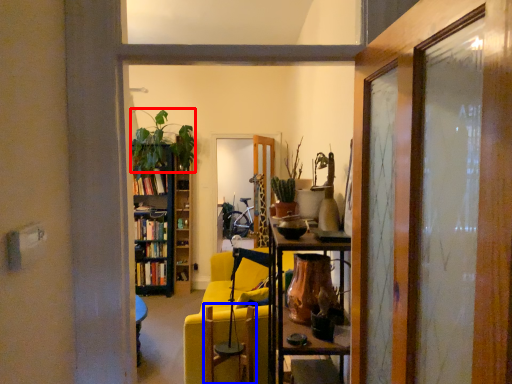
Question: Which object is closer to the camera taking this photo, houseplant (highlighted by a red box) or swivel chair (highlighted by a blue box)?

Choices:
 (A) houseplant
 (B) swivel chair

Answer: (B)